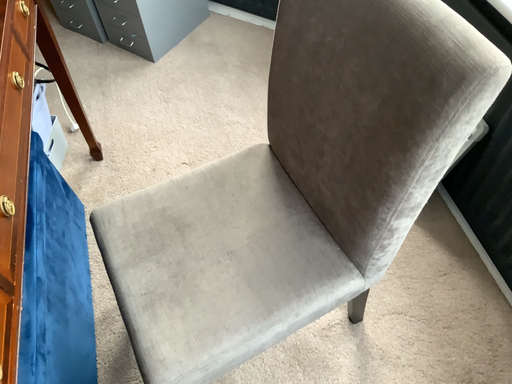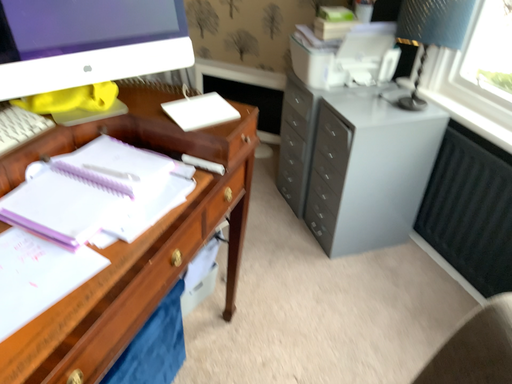
Question: How did the camera likely rotate when shooting the video?

Choices:
 (A) rotated right
 (B) rotated left

Answer: (B)